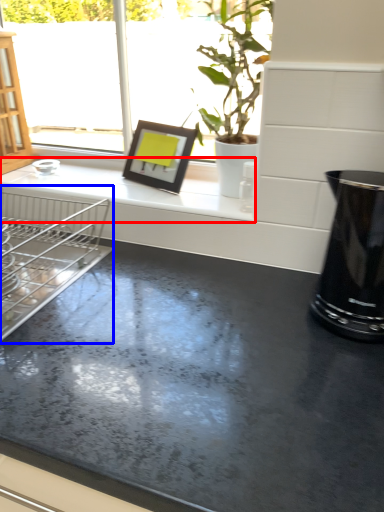
Question: Which object appears closest to the camera in this image, counter top (highlighted by a red box) or dish washer (highlighted by a blue box)?

Choices:
 (A) counter top
 (B) dish washer

Answer: (B)